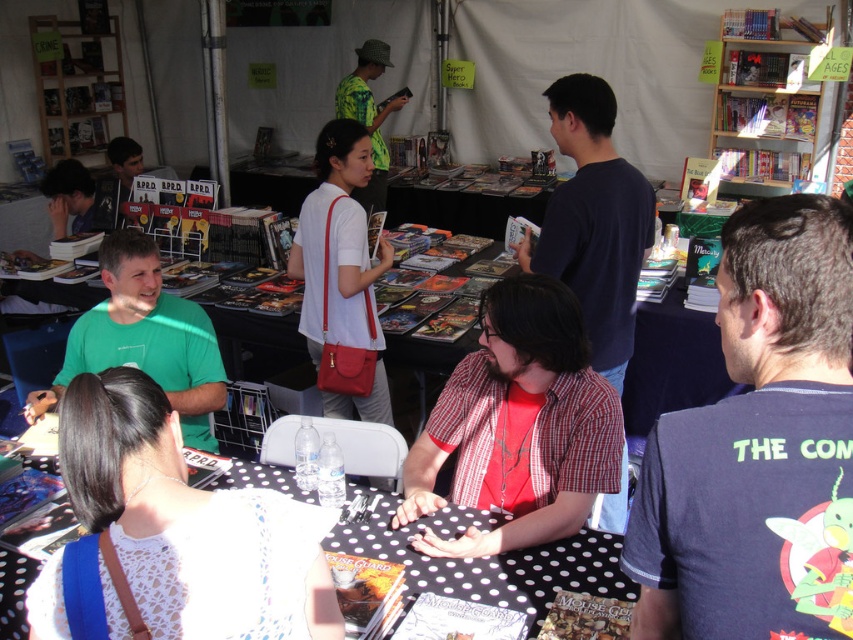
Question: Is black polka dot tablecloth at center closer to the viewer compared to green t-shirt at left?

Choices:
 (A) yes
 (B) no

Answer: (A)

Question: Which of the following is the closest to the observer?

Choices:
 (A) (773, 186)
 (B) (428, 464)
 (C) (91, 220)
 (D) (166, 348)

Answer: (B)

Question: Which object is closer to the camera taking this photo?

Choices:
 (A) red plaid shirt at center
 (B) wooden bookshelf at upper right
 (C) dark blue t-shirt at right
 (D) dark blue shirt at center

Answer: (C)

Question: Among these points, which one is farthest from the camera?

Choices:
 (A) (608, 372)
 (B) (469, 356)

Answer: (A)

Question: Can you confirm if white lace shirt at lower left is bigger than white matte bag at center?

Choices:
 (A) no
 (B) yes

Answer: (A)

Question: Is red plaid shirt at center above wooden bookshelf at upper right?

Choices:
 (A) yes
 (B) no

Answer: (B)